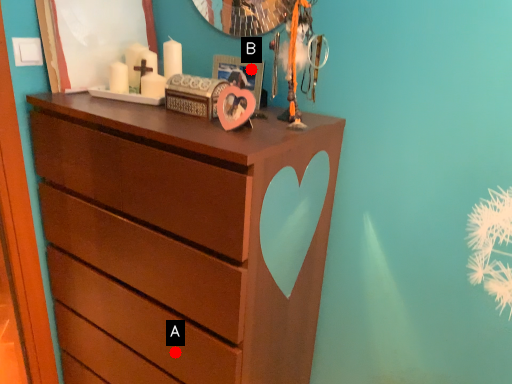
Question: Two points are circled on the image, labeled by A and B beside each circle. Which point is farther from the camera taking this photo?

Choices:
 (A) A is further
 (B) B is further

Answer: (B)